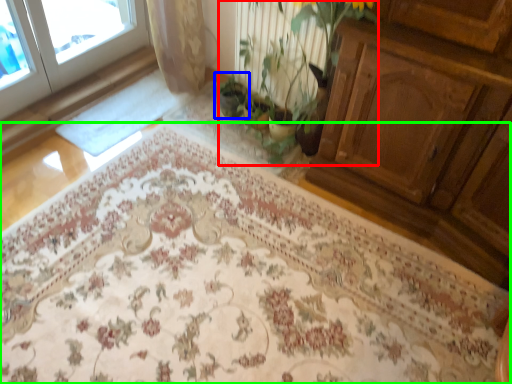
Question: Which object is positioned closest to floral arrangement (highlighted by a red box)? Select from houseplant (highlighted by a blue box) and mat (highlighted by a green box).

Choices:
 (A) houseplant
 (B) mat

Answer: (A)